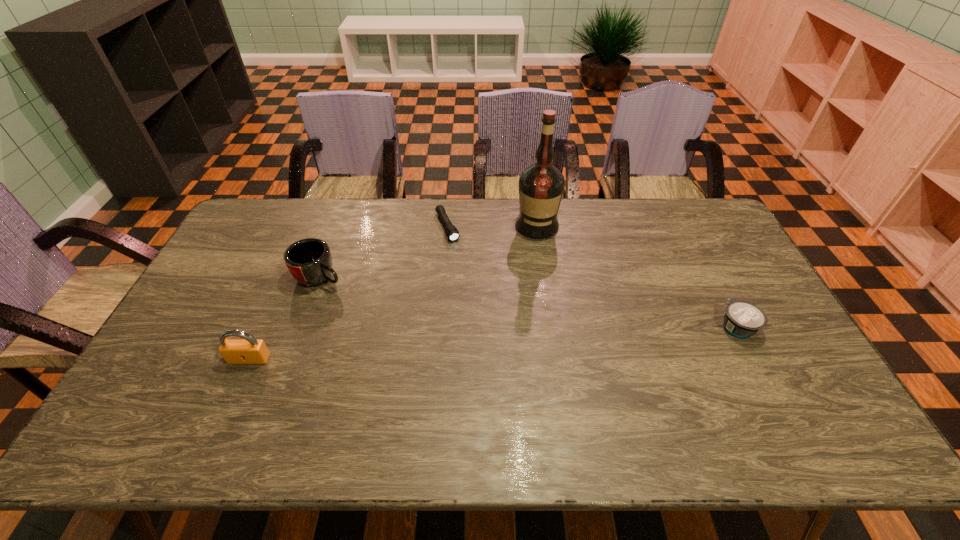
Image resolution: width=960 pixels, height=540 pixels. Find the location of `free space located 0.110m on the surface of the second object from right to left`. free space located 0.110m on the surface of the second object from right to left is located at coordinates (535, 261).

The width and height of the screenshot is (960, 540). Identify the location of vacant area situated on the surface of the second object from right to left. (534, 269).

The width and height of the screenshot is (960, 540). What are the coordinates of `vacant region located 0.140m on the surface of the second object from right to left` in the screenshot? It's located at (534, 267).

Locate an element on the screen. The image size is (960, 540). vacant space located at the lens end of the shortest object is located at coordinates (480, 300).

This screenshot has width=960, height=540. I want to click on free point located 0.070m at the lens end of the shortest object, so click(458, 255).

Locate an element on the screen. The image size is (960, 540). blank space located 0.140m at the lens end of the shortest object is located at coordinates (465, 269).

Where is `vacant space situated on the side of the third nearest object with the handle`? This screenshot has height=540, width=960. vacant space situated on the side of the third nearest object with the handle is located at coordinates (353, 292).

The width and height of the screenshot is (960, 540). In order to click on free space located 0.290m on the side of the third nearest object with the handle in this screenshot , I will do `click(413, 324)`.

Where is `free location located 0.150m on the side of the third nearest object with the handle`? free location located 0.150m on the side of the third nearest object with the handle is located at coordinates tap(376, 304).

In order to click on liquor present at the far edge in this screenshot , I will do 541,185.